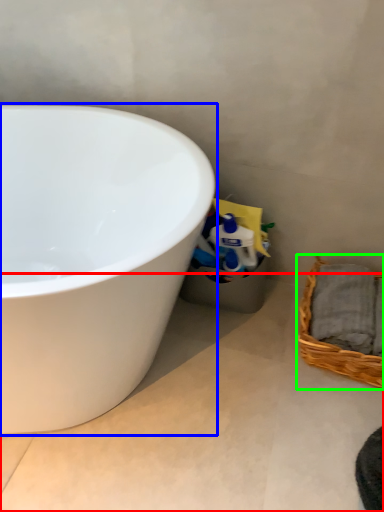
Question: Considering the real-world distances, which object is closest to concrete (highlighted by a red box)? bathtub (highlighted by a blue box) or picnic basket (highlighted by a green box).

Choices:
 (A) bathtub
 (B) picnic basket

Answer: (B)